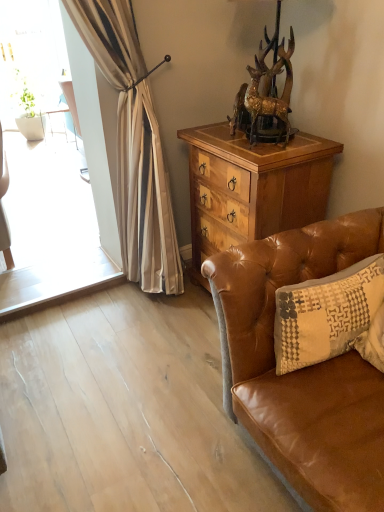
Question: Considering the relative positions of wooden cabinet at center and beige textured pillow at right in the image provided, is wooden cabinet at center to the left or to the right of beige textured pillow at right?

Choices:
 (A) right
 (B) left

Answer: (B)

Question: From the image's perspective, relative to beige textured pillow at right, is wooden cabinet at center above or below?

Choices:
 (A) above
 (B) below

Answer: (A)

Question: Estimate the real-world distances between objects in this image. Which object is farther from the brown leather couch at lower right?

Choices:
 (A) wooden cabinet at center
 (B) gold metallic deer at upper center
 (C) beige textured pillow at right

Answer: (B)

Question: Which is nearer to the gold metallic deer at upper center?

Choices:
 (A) wooden cabinet at center
 (B) beige textured pillow at right
 (C) brown leather couch at lower right

Answer: (A)